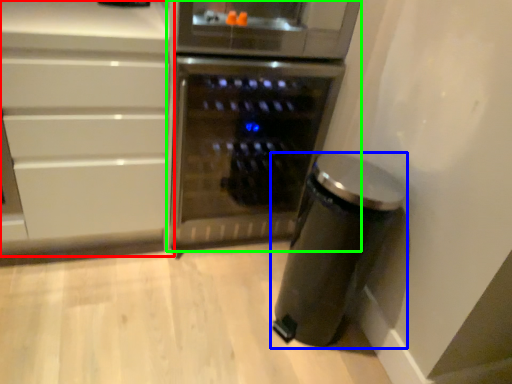
Question: Based on their relative distances, which object is farther from cabinetry (highlighted by a red box)? Choose from kitchen appliance (highlighted by a blue box) and home appliance (highlighted by a green box).

Choices:
 (A) kitchen appliance
 (B) home appliance

Answer: (A)